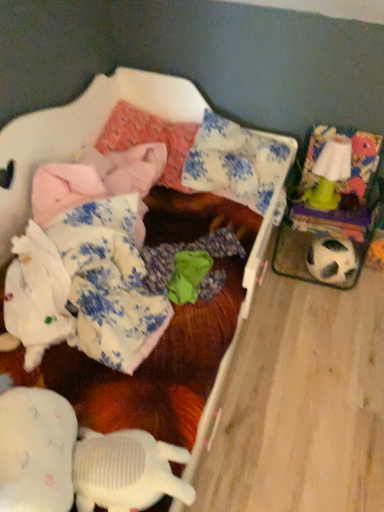
Describe the element at coordinates (234, 163) in the screenshot. This screenshot has height=512, width=384. I see `blue floral fabric pillow at center, marked as the 1th pillow in a right-to-left arrangement` at that location.

Locate an element on the screen. pink fabric pillow at upper center, positioned as the 1th pillow in left-to-right order is located at coordinates (149, 139).

Locate an element on the screen. The width and height of the screenshot is (384, 512). green fabric at center, which is the 2th clothing from left to right is located at coordinates (187, 250).

Describe the element at coordinates (331, 260) in the screenshot. I see `black and white textured football at right` at that location.

Image resolution: width=384 pixels, height=512 pixels. Identify the location of white fabric at lower left, the 2th clothing from the right. (85, 287).

Is green plastic lamp at upper right not inside fluffy pink blanket at upper left?

Yes, green plastic lamp at upper right is located beyond the bounds of fluffy pink blanket at upper left.

Considering the relative positions of green plastic lamp at upper right and fluffy pink blanket at upper left in the image provided, is green plastic lamp at upper right to the right of fluffy pink blanket at upper left from the viewer's perspective?

Indeed, green plastic lamp at upper right is positioned on the right side of fluffy pink blanket at upper left.

In the scene shown: Measure the distance from green plastic lamp at upper right to fluffy pink blanket at upper left.

green plastic lamp at upper right and fluffy pink blanket at upper left are 21.65 inches apart.

Looking at this image, from a real-world perspective, is green plastic lamp at upper right located higher than fluffy pink blanket at upper left?

Indeed, from a real-world perspective, green plastic lamp at upper right stands above fluffy pink blanket at upper left.

Which object is closer to the camera, green plastic lamp at upper right or blue floral fabric pillow at center, marked as the 1th pillow in a right-to-left arrangement?

Positioned in front is blue floral fabric pillow at center, marked as the 1th pillow in a right-to-left arrangement.

Is green plastic lamp at upper right placed right next to blue floral fabric pillow at center, marked as the 1th pillow in a right-to-left arrangement?

green plastic lamp at upper right is not next to blue floral fabric pillow at center, marked as the 1th pillow in a right-to-left arrangement, and they're not touching.

Considering the positions of objects green plastic lamp at upper right and blue floral fabric pillow at center, marked as the 1th pillow in a right-to-left arrangement, in the image provided, who is more to the left, green plastic lamp at upper right or blue floral fabric pillow at center, marked as the 1th pillow in a right-to-left arrangement,?

From the viewer's perspective, blue floral fabric pillow at center, marked as the 1th pillow in a right-to-left arrangement, appears more on the left side.

Can you confirm if green plastic lamp at upper right is smaller than blue floral fabric pillow at center, marked as the 1th pillow in a right-to-left arrangement?

Yes, green plastic lamp at upper right is smaller than blue floral fabric pillow at center, marked as the 1th pillow in a right-to-left arrangement.

Does point (177, 154) lie in front of point (188, 129)?

Yes, it is in front of point (188, 129).

Is the surface of fluffy pink blanket at upper left in direct contact with pink fabric pillow at upper center, placed as the second pillow when sorted from right to left?

fluffy pink blanket at upper left and pink fabric pillow at upper center, placed as the second pillow when sorted from right to left, are clearly separated.

Choose the correct answer: Is fluffy pink blanket at upper left inside pink fabric pillow at upper center, placed as the second pillow when sorted from right to left, or outside it?

fluffy pink blanket at upper left is not inside pink fabric pillow at upper center, placed as the second pillow when sorted from right to left, it's outside.

Is fluffy pink blanket at upper left facing towards pink fabric pillow at upper center, positioned as the 1th pillow in left-to-right order?

No, fluffy pink blanket at upper left is not oriented towards pink fabric pillow at upper center, positioned as the 1th pillow in left-to-right order.

At what (x,y) coordinates should I click in order to perform the action: click on the 2nd clothing in front of the pink fabric pillow at upper center, placed as the second pillow when sorted from right to left. Please return your answer as a coordinate pair (x, y). Looking at the image, I should click on point(85,287).

Considering the sizes of objects white fabric at lower left, the 2th clothing from the right, and pink fabric pillow at upper center, positioned as the 1th pillow in left-to-right order, in the image provided, who is wider, white fabric at lower left, the 2th clothing from the right, or pink fabric pillow at upper center, positioned as the 1th pillow in left-to-right order,?

With larger width is pink fabric pillow at upper center, positioned as the 1th pillow in left-to-right order.

Is white fabric at lower left, positioned as the first clothing in left-to-right order, to the left or to the right of pink fabric pillow at upper center, placed as the second pillow when sorted from right to left, in the image?

white fabric at lower left, positioned as the first clothing in left-to-right order, is to the left of pink fabric pillow at upper center, placed as the second pillow when sorted from right to left.

From a real-world perspective, between white fabric at lower left, the 2th clothing from the right, and pink fabric pillow at upper center, positioned as the 1th pillow in left-to-right order, who is vertically lower?

pink fabric pillow at upper center, positioned as the 1th pillow in left-to-right order, from a real-world perspective.

In the scene shown: Can you confirm if fluffy pink blanket at upper left is wider than white fabric at lower left, the 2th clothing from the right?

Yes.

This screenshot has width=384, height=512. I want to click on bed above the white fabric at lower left, the 2th clothing from the right (from the image's perspective), so click(x=93, y=141).

Who is shorter, fluffy pink blanket at upper left or white fabric at lower left, the 2th clothing from the right?

Standing shorter between the two is white fabric at lower left, the 2th clothing from the right.

Is fluffy pink blanket at upper left not near white fabric at lower left, positioned as the first clothing in left-to-right order?

That's not correct — fluffy pink blanket at upper left is a little close to white fabric at lower left, positioned as the first clothing in left-to-right order.

Would you say fluffy pink blanket at upper left is inside or outside white plush toy at lower left?

fluffy pink blanket at upper left is located beyond the bounds of white plush toy at lower left.

Who is smaller, fluffy pink blanket at upper left or white plush toy at lower left?

white plush toy at lower left is smaller.

Where is `bed in front of the white plush toy at lower left`? Image resolution: width=384 pixels, height=512 pixels. bed in front of the white plush toy at lower left is located at coordinates (93, 141).

Does point (240, 184) lie in front of point (187, 123)?

Yes.

From the image's perspective, is blue floral fabric pillow at center, which is the second pillow from left to right, below pink fabric pillow at upper center, positioned as the 1th pillow in left-to-right order?

Yes, from the image's perspective, blue floral fabric pillow at center, which is the second pillow from left to right, is beneath pink fabric pillow at upper center, positioned as the 1th pillow in left-to-right order.

Considering the sizes of objects blue floral fabric pillow at center, marked as the 1th pillow in a right-to-left arrangement, and pink fabric pillow at upper center, positioned as the 1th pillow in left-to-right order, in the image provided, who is taller, blue floral fabric pillow at center, marked as the 1th pillow in a right-to-left arrangement, or pink fabric pillow at upper center, positioned as the 1th pillow in left-to-right order,?

blue floral fabric pillow at center, marked as the 1th pillow in a right-to-left arrangement.

Is blue floral fabric pillow at center, marked as the 1th pillow in a right-to-left arrangement, beside pink fabric pillow at upper center, positioned as the 1th pillow in left-to-right order?

No, blue floral fabric pillow at center, marked as the 1th pillow in a right-to-left arrangement, is not in contact with pink fabric pillow at upper center, positioned as the 1th pillow in left-to-right order.

What are the coordinates of `toy above the fluffy pink blanket at upper left (from the image's perspective)` in the screenshot? It's located at (329, 173).

Where is `toy located behind the blue floral fabric pillow at center, which is the second pillow from left to right`? This screenshot has height=512, width=384. toy located behind the blue floral fabric pillow at center, which is the second pillow from left to right is located at coordinates (329, 173).

Based on their spatial positions, is white fabric at lower left, positioned as the first clothing in left-to-right order, or fluffy pink blanket at upper left closer to green fabric at center, which is the 2th clothing from left to right?

The object closer to green fabric at center, which is the 2th clothing from left to right, is white fabric at lower left, positioned as the first clothing in left-to-right order.

Considering their positions, is blue floral fabric pillow at center, marked as the 1th pillow in a right-to-left arrangement, positioned closer to green fabric at center, which is the 2th clothing from left to right, than white fabric at lower left, the 2th clothing from the right?

white fabric at lower left, the 2th clothing from the right, lies closer to green fabric at center, which is the 2th clothing from left to right, than the other object.

From the image, which object appears to be farther from fluffy pink blanket at upper left, green fabric at center, which is the 2th clothing from left to right, or green plastic lamp at upper right?

The object further to fluffy pink blanket at upper left is green plastic lamp at upper right.

Which object lies further to the anchor point black and white textured football at right, fluffy pink blanket at upper left or pink fabric pillow at upper center, positioned as the 1th pillow in left-to-right order?

The object further to black and white textured football at right is pink fabric pillow at upper center, positioned as the 1th pillow in left-to-right order.

Considering their positions, is green fabric at center, which is the 2th clothing from left to right, positioned closer to fluffy pink blanket at upper left than black and white textured football at right?

green fabric at center, which is the 2th clothing from left to right.

Which object lies further to the anchor point black and white textured football at right, fluffy pink blanket at upper left or white fabric at lower left, the 2th clothing from the right?

white fabric at lower left, the 2th clothing from the right, is positioned further to the anchor black and white textured football at right.

Based on their spatial positions, is black and white textured football at right or white fabric at lower left, positioned as the first clothing in left-to-right order, further from pink fabric pillow at upper center, placed as the second pillow when sorted from right to left?

black and white textured football at right is further to pink fabric pillow at upper center, placed as the second pillow when sorted from right to left.

From the picture: Considering their positions, is white plush toy at lower left positioned further to black and white textured football at right than blue floral fabric pillow at center, which is the second pillow from left to right?

Based on the image, white plush toy at lower left appears to be further to black and white textured football at right.

Identify the location of clothing located between white fabric at lower left, the 2th clothing from the right, and green plastic lamp at upper right in the left-right direction. This screenshot has width=384, height=512. (187, 250).

Locate an element on the screen. This screenshot has height=512, width=384. pillow situated between pink fabric pillow at upper center, placed as the second pillow when sorted from right to left, and black and white textured football at right from left to right is located at coordinates (234, 163).

This screenshot has height=512, width=384. What are the coordinates of `clothing between fluffy pink blanket at upper left and green fabric at center, acting as the first clothing starting from the right, in the front-back direction` in the screenshot? It's located at (85, 287).

You are a GUI agent. You are given a task and a screenshot of the screen. Output one action in this format:
    pyautogui.click(x=<x>, y=<y>)
    Task: Click on the clothing between pink fabric pillow at upper center, placed as the second pillow when sorted from right to left, and green plastic lamp at upper right, in the horizontal direction
    This screenshot has height=512, width=384.
    Given the screenshot: What is the action you would take?
    pyautogui.click(x=187, y=250)